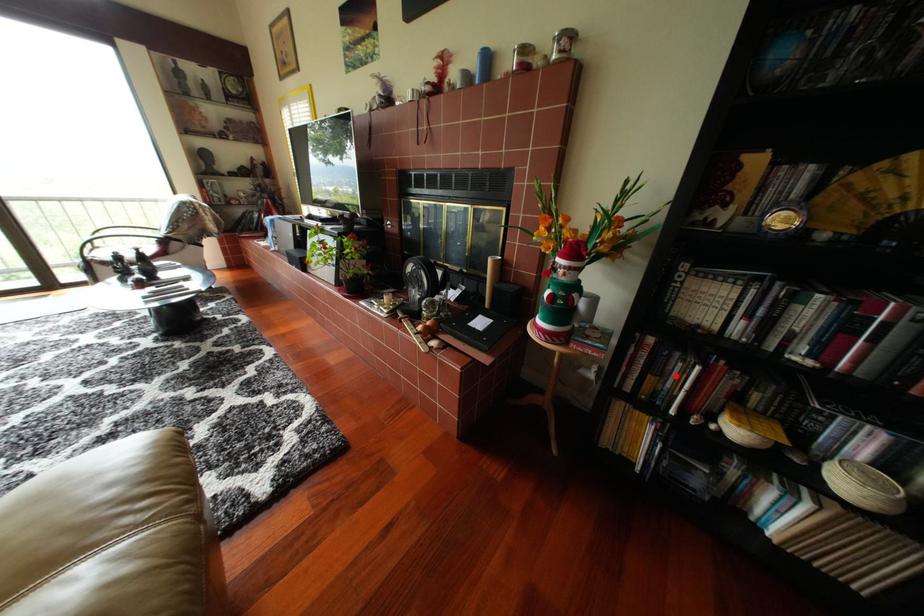
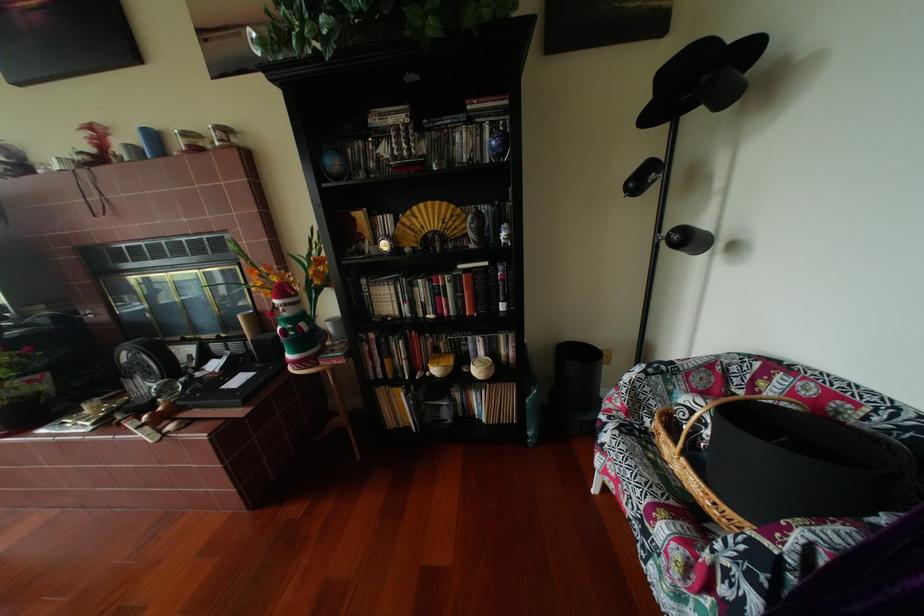
Where in the second image is the point corresponding to the highlighted location from the first image?

(404, 357)